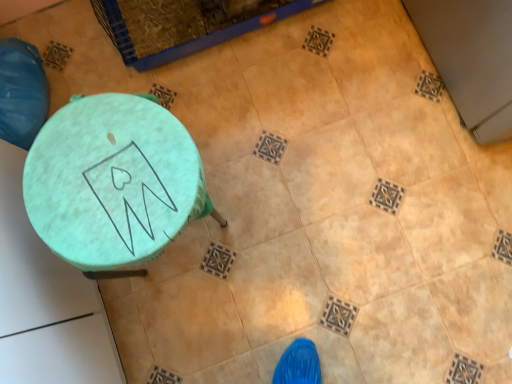
Locate an element on the screen. This screenshot has width=512, height=384. spots to the right of teal fabric-covered stool at lower left is located at coordinates (278, 205).